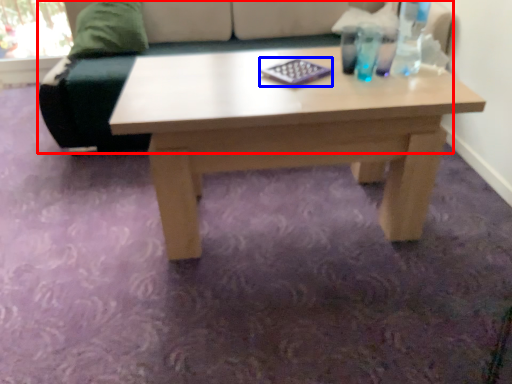
Question: Which object appears farthest to the camera in this image, studio couch (highlighted by a red box) or pad (highlighted by a blue box)?

Choices:
 (A) studio couch
 (B) pad

Answer: (A)